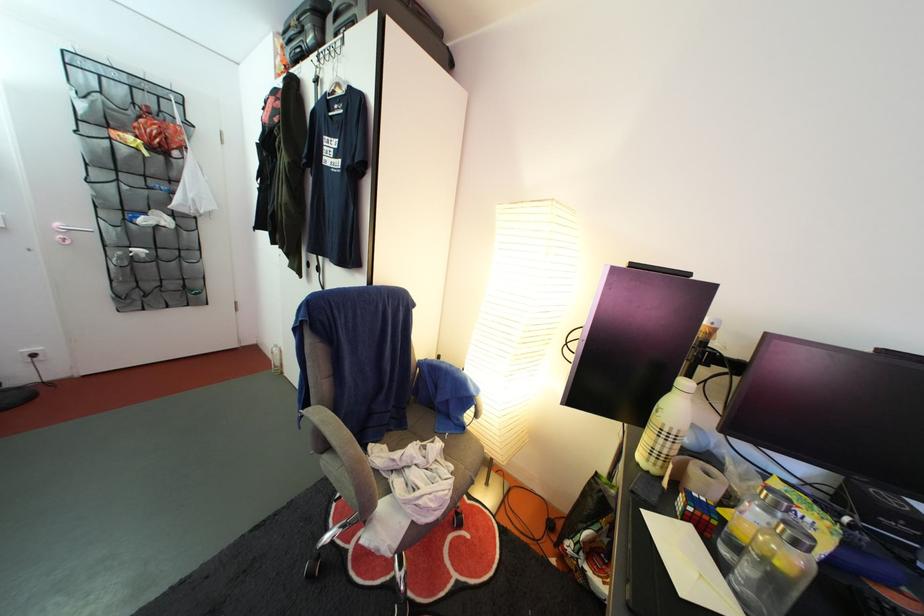
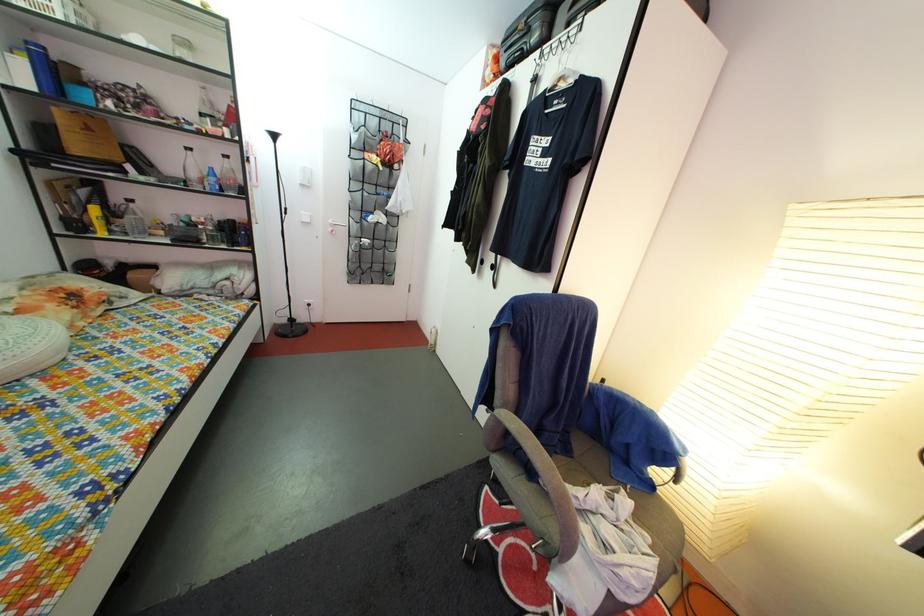
Question: What movement of the cameraman would produce the second image?

Choices:
 (A) Left
 (B) Right
 (C) Forward
 (D) Backward

Answer: (A)